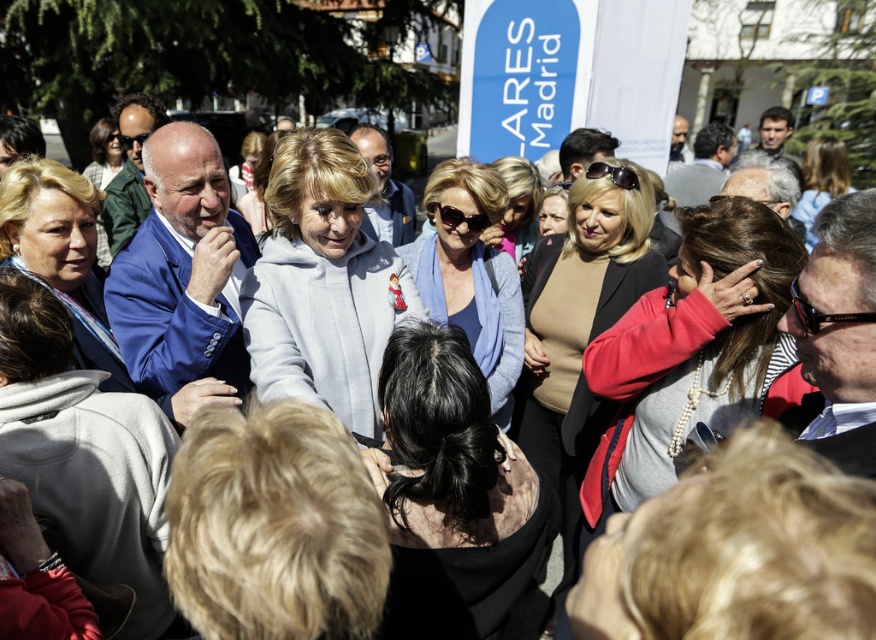
Question: Which object is positioned farthest from the beige sweater at center?

Choices:
 (A) black silky hair at center
 (B) matte black jacket at center
 (C) matte blue suit at center

Answer: (B)

Question: Which point is farther to the camera?

Choices:
 (A) (811, 214)
 (B) (506, 157)
 (C) (309, 355)

Answer: (A)

Question: Observing the image, what is the correct spatial positioning of matte blue suit at center in reference to matte gray hoodie at center?

Choices:
 (A) above
 (B) below

Answer: (B)

Question: Can you confirm if matte blue sweater at center is wider than matte black jacket at center?

Choices:
 (A) yes
 (B) no

Answer: (B)

Question: Which point is closer to the camera?

Choices:
 (A) (513, 164)
 (B) (484, 515)

Answer: (B)

Question: Does beige sweater at center have a smaller size compared to matte blue suit at center?

Choices:
 (A) yes
 (B) no

Answer: (A)